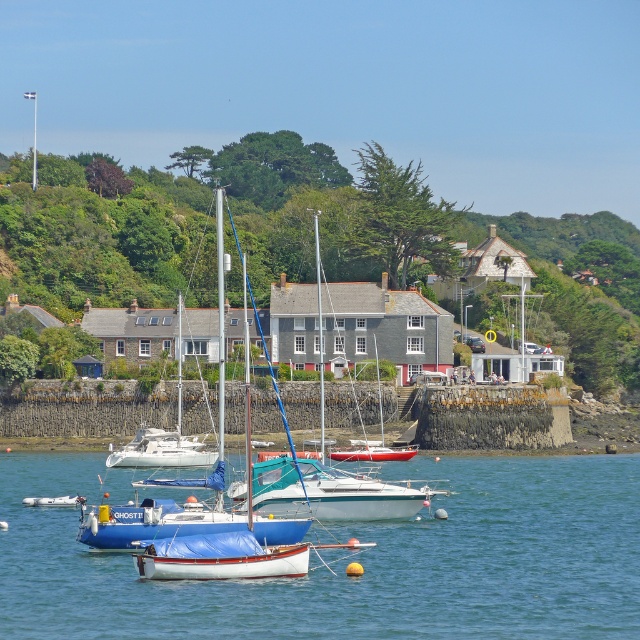
Where is `white matte sailboat at center`? The width and height of the screenshot is (640, 640). white matte sailboat at center is located at coordinates (220, 557).

In the scene shown: Does white matte sailboat at center appear over blue matte sailboat at center?

Yes.

Between point (221, 545) and point (74, 500), which one is positioned behind?

The point (74, 500) is more distant.

The width and height of the screenshot is (640, 640). What are the coordinates of `white matte sailboat at center` in the screenshot? It's located at click(x=220, y=557).

Consider the image. Is blue water at center to the right of white matte sailboat at center from the viewer's perspective?

Correct, you'll find blue water at center to the right of white matte sailboat at center.

Does blue water at center lie in front of white matte sailboat at center?

Yes, it is in front of white matte sailboat at center.

At what (x,y) coordinates should I click in order to perform the action: click on blue water at center. Please return your answer as a coordinate pair (x, y). Looking at the image, I should click on (349, 561).

Is blue water at center thinner than blue matte sailboat at center?

No.

Between point (74, 593) and point (36, 499), which one is positioned in front?

Point (74, 593)

Locate an element on the screen. blue water at center is located at coordinates (349, 561).